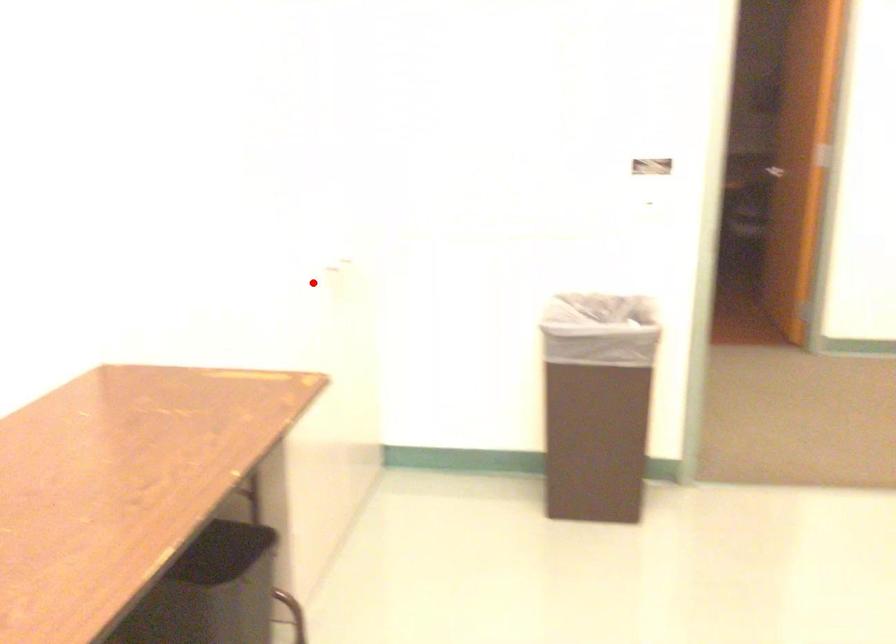
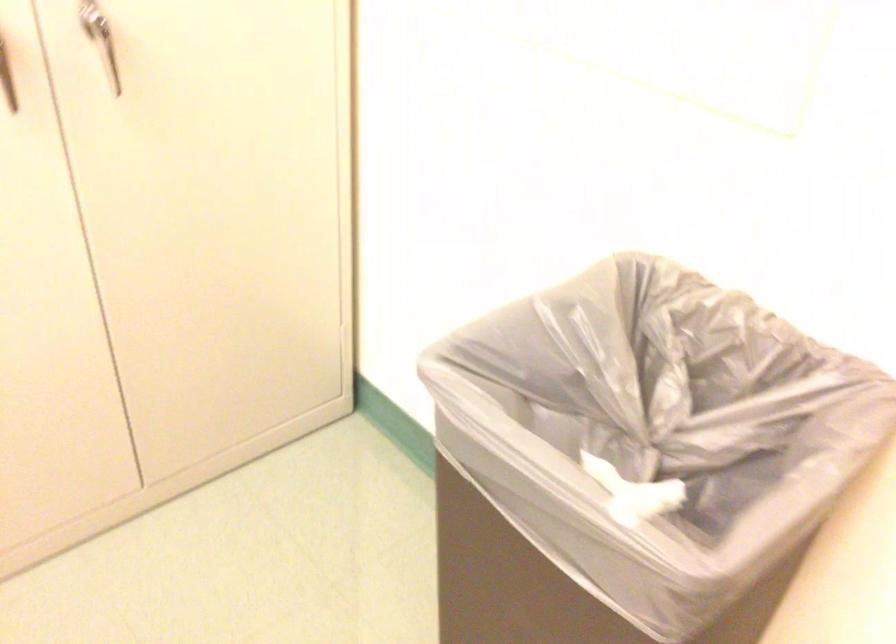
Question: A red point is marked in image1. In image2, is the corresponding 3D point closer to the camera or farther? Reply with the corresponding letter.

Choices:
 (A) The corresponding 3D point is closer.
 (B) The corresponding 3D point is farther.

Answer: (A)